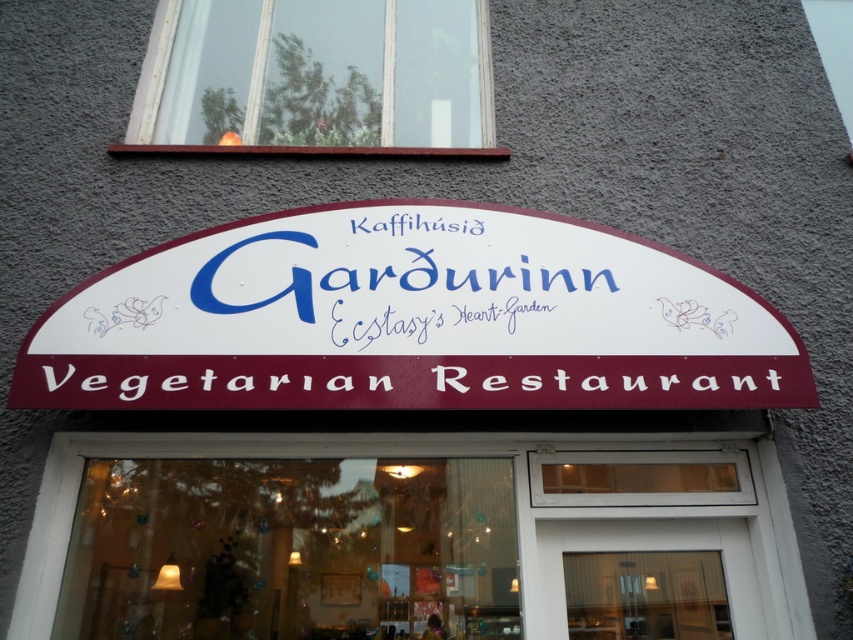
You are a customer arriving at the vegetarian restaurant and want to enter. The entrance is marked by the white wooden door at center and the white paper sign at center. Which object should you approach first to enter the restaurant?

The white wooden door at center is below the white paper sign at center, so you should approach the white wooden door at center first to enter the restaurant.

You are a customer standing in front of the restaurant entrance. You want to read the restaurant name displayed on the white plastic sign at center. Which direction should you look relative to the white wood window at upper center?

The white plastic sign at center is located below the white wood window at upper center, so you should look downward from the white wood window at upper center to see the restaurant name on the white plastic sign at center.

Looking at this image, you are a customer standing in front of the restaurant entrance. You want to read the restaurant name displayed on the white plastic sign at center and the white wood window at upper center. Which object is shorter in height?

The white plastic sign at center has a lesser height compared to the white wood window at upper center, so the white plastic sign at center is shorter in height.